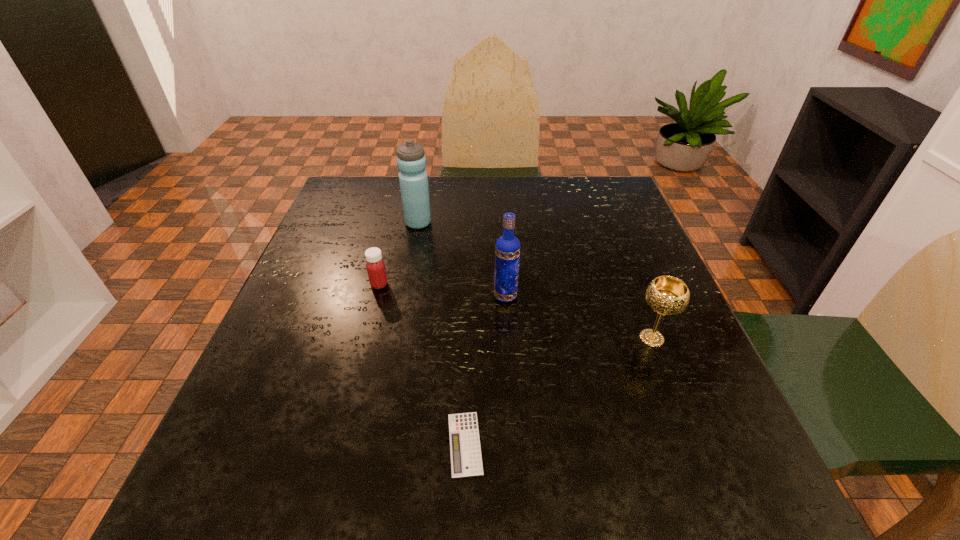
Where is `free point between the vodka and the water bottle`? This screenshot has width=960, height=540. free point between the vodka and the water bottle is located at coordinates click(x=462, y=260).

You are a GUI agent. You are given a task and a screenshot of the screen. Output one action in this format:
    pyautogui.click(x=<x>, y=<y>)
    Task: Click on the free area in between the leftmost object and the third object from right to left
    Image resolution: width=960 pixels, height=540 pixels.
    Given the screenshot: What is the action you would take?
    pyautogui.click(x=422, y=364)

Locate an element on the screen. The height and width of the screenshot is (540, 960). free space between the fourth object from left to right and the chalice is located at coordinates (579, 318).

The image size is (960, 540). I want to click on empty space between the leftmost object and the second nearest object, so click(516, 312).

Where is `object that is the third closest to the third shortest object`? Image resolution: width=960 pixels, height=540 pixels. object that is the third closest to the third shortest object is located at coordinates (375, 265).

Identify which object is the closest to the third object from left to right. Please provide its 2D coordinates. Your answer should be formatted as a tuple, i.e. [(x, y)], where the tuple contains the x and y coordinates of a point satisfying the conditions above.

[(507, 249)]

Identify the location of vacant region that satisfies the following two spatial constraints: 1. on the front side of the second object from left to right; 2. on the right side of the fourth object from left to right. (404, 296).

I want to click on free location that satisfies the following two spatial constraints: 1. on the back side of the shortest object; 2. on the right side of the chalice, so click(468, 339).

Locate an element on the screen. vacant space that satisfies the following two spatial constraints: 1. on the front side of the second object from right to left; 2. on the left side of the leftmost object is located at coordinates (376, 296).